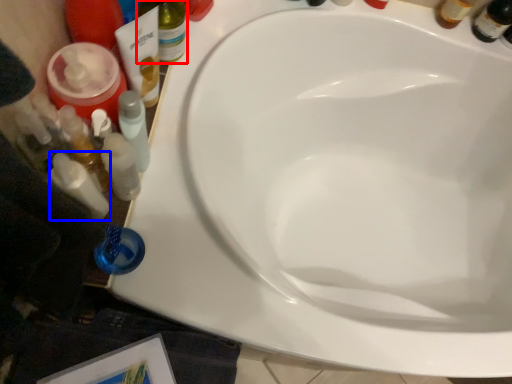
Question: Which object is closer to the camera taking this photo, bottle (highlighted by a red box) or toiletry (highlighted by a blue box)?

Choices:
 (A) bottle
 (B) toiletry

Answer: (B)